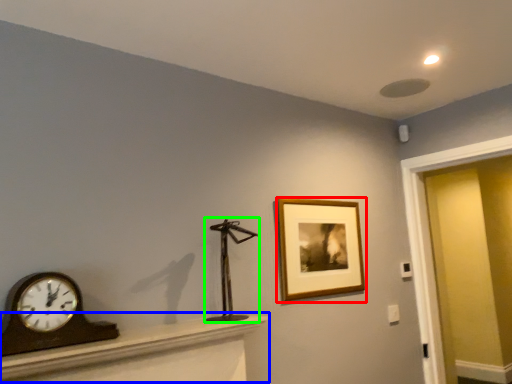
Question: Which object is the closest to the picture frame (highlighted by a red box)? Choose among these: furniture (highlighted by a blue box) or sculpture (highlighted by a green box).

Choices:
 (A) furniture
 (B) sculpture

Answer: (B)